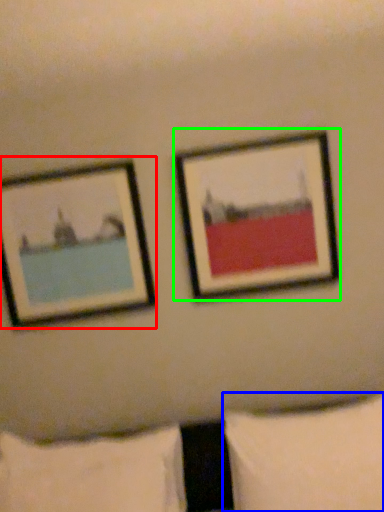
Question: Based on their relative distances, which object is nearer to picture frame (highlighted by a red box)? Choose from pillow (highlighted by a blue box) and picture frame (highlighted by a green box).

Choices:
 (A) pillow
 (B) picture frame

Answer: (B)